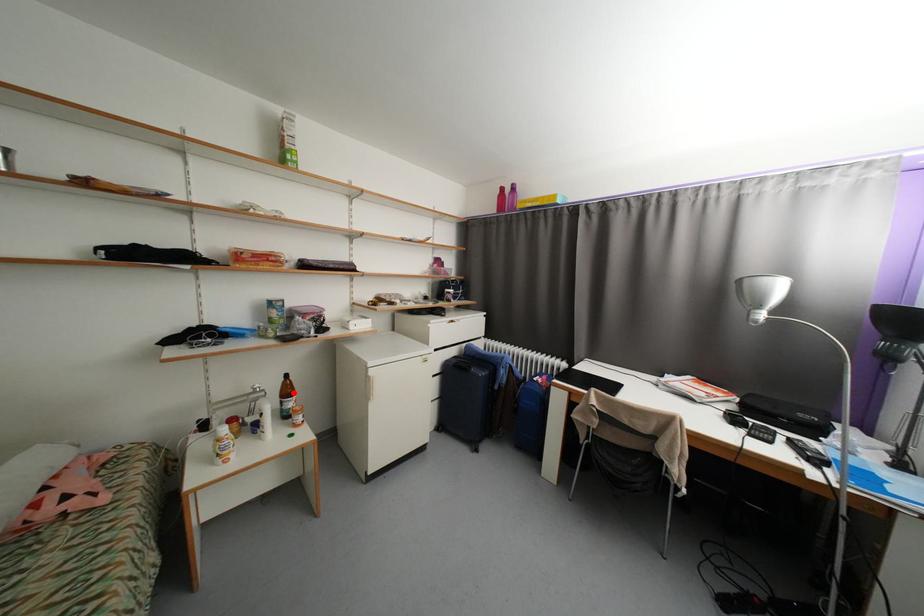
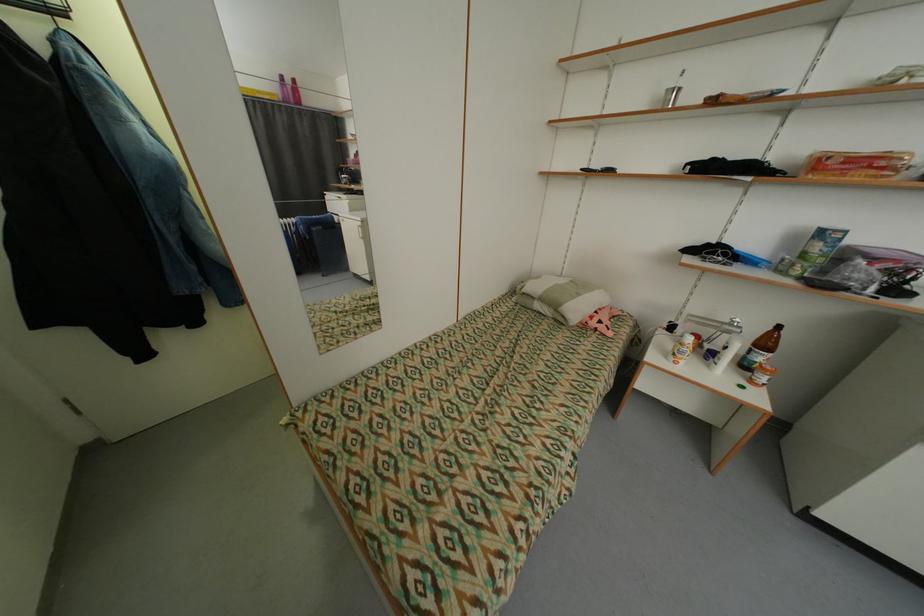
The point at the highlighted location is marked in the first image. Where is the corresponding point in the second image?

(772, 345)